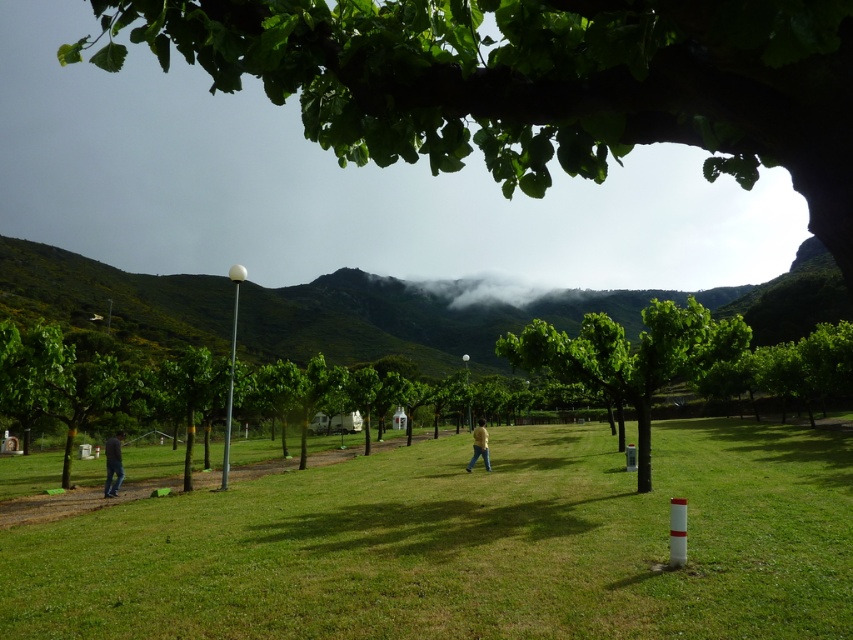
Based on the scene, which object takes up more area in the image between the green grassy field at center and the green leafy tree at upper center?

The green leafy tree at upper center occupies more space than the green grassy field at center in the image.

You are standing on the grassy field and want to take a photo of the dark blue jeans at lower left and the white fluffy cloud at center. Which object should you focus on first to ensure both are in focus?

You should focus on the dark blue jeans at lower left first because it is closer to you than the white fluffy cloud at center, which is further away. This way, both objects will be in focus as the cloud is behind the jeans.